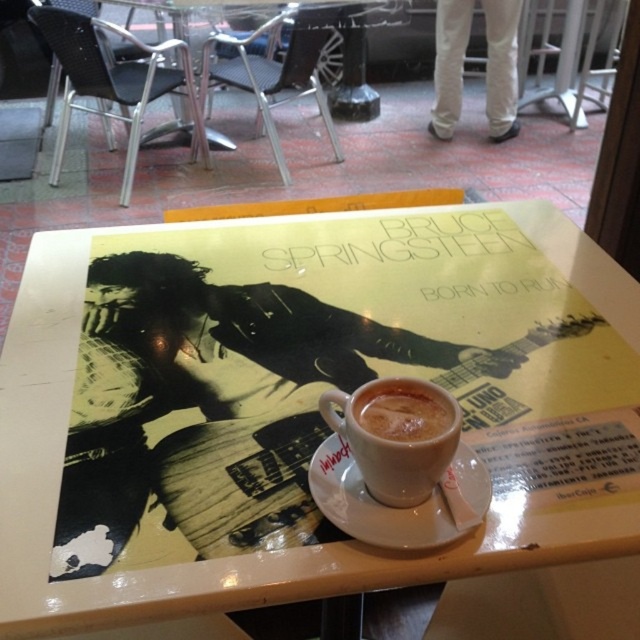
You are a barista who needs to place a new coffee order on the table. The customer requested a drink that must fit entirely on the white ceramic saucer at center. Can the white frothy coffee at center currently on the saucer accommodate the new order without spilling?

The white ceramic saucer at center is bigger than the white frothy coffee at center, so yes, the new order can fit on the saucer without spilling since the saucer has enough space around the existing coffee.

You are a barista who needs to place a new coffee cup at the point marked as point (572,380) on the table. The table is 36 inches away from you. Can you reach the point without moving your position?

The distance of point (572,380) from camera is 28.57 inches, so yes, the barista can reach the point without moving since it is within the 36 inches distance from their current position.